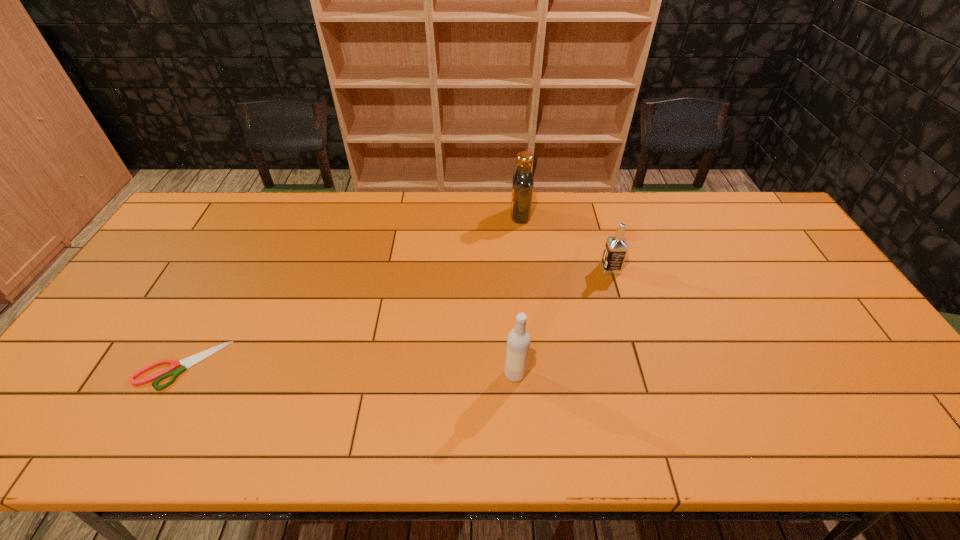
Find the location of a particular element. the farthest vodka is located at coordinates (522, 182).

This screenshot has height=540, width=960. In order to click on the nearest vodka in this screenshot , I will do `click(518, 341)`.

Find the location of a particular element. The image size is (960, 540). the rightmost vodka is located at coordinates (616, 247).

Identify the location of the second nearest vodka. (616, 247).

At what (x,y) coordinates should I click in order to perform the action: click on the leftmost object. Please return your answer as a coordinate pair (x, y). Looking at the image, I should click on (178, 367).

This screenshot has height=540, width=960. I want to click on the shortest object, so click(x=178, y=367).

The height and width of the screenshot is (540, 960). Identify the location of vacant space located on the front-facing side of the farthest object. (394, 215).

You are a GUI agent. You are given a task and a screenshot of the screen. Output one action in this format:
    pyautogui.click(x=<x>, y=<y>)
    Task: Click on the blank area located on the front-facing side of the farthest object
    This screenshot has width=960, height=540.
    Given the screenshot: What is the action you would take?
    pyautogui.click(x=475, y=215)

Locate an element on the screen. The height and width of the screenshot is (540, 960). vacant space located 0.390m on the front-facing side of the farthest object is located at coordinates (396, 215).

Where is `free space located on the left of the nearest vodka`? This screenshot has height=540, width=960. free space located on the left of the nearest vodka is located at coordinates (464, 374).